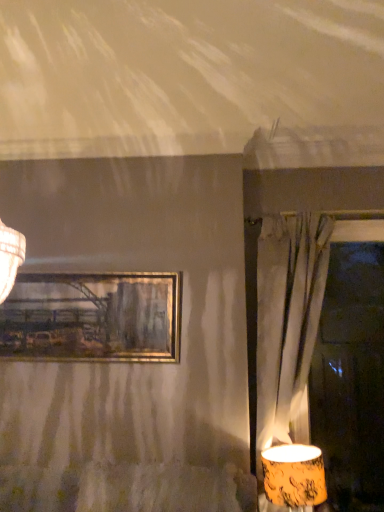
Question: Can you confirm if matte orange lampshade at lower right is positioned to the right of matte gray curtain at right?

Choices:
 (A) no
 (B) yes

Answer: (A)

Question: Is matte orange lampshade at lower right located outside matte gray curtain at right?

Choices:
 (A) yes
 (B) no

Answer: (B)

Question: From the image's perspective, does matte orange lampshade at lower right appear lower than matte gray curtain at right?

Choices:
 (A) no
 (B) yes

Answer: (B)

Question: Does matte orange lampshade at lower right come behind matte gray curtain at right?

Choices:
 (A) no
 (B) yes

Answer: (A)

Question: Is matte orange lampshade at lower right shorter than matte gray curtain at right?

Choices:
 (A) no
 (B) yes

Answer: (B)

Question: Does matte orange lampshade at lower right have a larger size compared to matte gray curtain at right?

Choices:
 (A) no
 (B) yes

Answer: (A)

Question: Is matte gray curtain at right behind matte orange lampshade at lower right?

Choices:
 (A) yes
 (B) no

Answer: (A)

Question: Is matte gray curtain at right aimed at matte orange lampshade at lower right?

Choices:
 (A) yes
 (B) no

Answer: (A)

Question: Can you confirm if matte gray curtain at right is positioned to the left of matte orange lampshade at lower right?

Choices:
 (A) no
 (B) yes

Answer: (A)

Question: Does matte gray curtain at right have a lesser width compared to matte orange lampshade at lower right?

Choices:
 (A) yes
 (B) no

Answer: (A)

Question: Considering the relative sizes of matte gray curtain at right and matte orange lampshade at lower right in the image provided, is matte gray curtain at right smaller than matte orange lampshade at lower right?

Choices:
 (A) no
 (B) yes

Answer: (A)

Question: Considering the relative positions of matte gray curtain at right and matte orange lampshade at lower right in the image provided, is matte gray curtain at right in front of matte orange lampshade at lower right?

Choices:
 (A) no
 (B) yes

Answer: (A)

Question: Is matte gray curtain at right beside gold metallic picture frame at upper center?

Choices:
 (A) yes
 (B) no

Answer: (B)